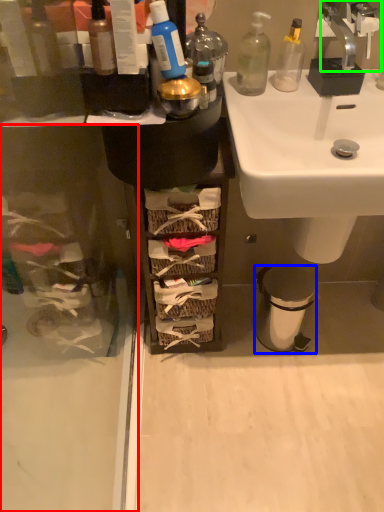
Question: Considering the real-world distances, which object is closest to screen door (highlighted by a red box)? trash bin/can (highlighted by a blue box) or tap (highlighted by a green box).

Choices:
 (A) trash bin/can
 (B) tap

Answer: (A)